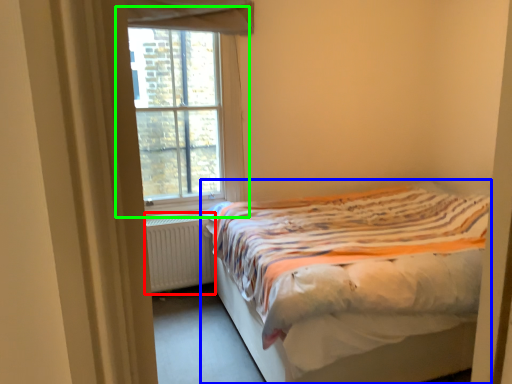
Question: Considering the real-world distances, which object is closest to radiator (highlighted by a red box)? bed (highlighted by a blue box) or window (highlighted by a green box).

Choices:
 (A) bed
 (B) window

Answer: (B)